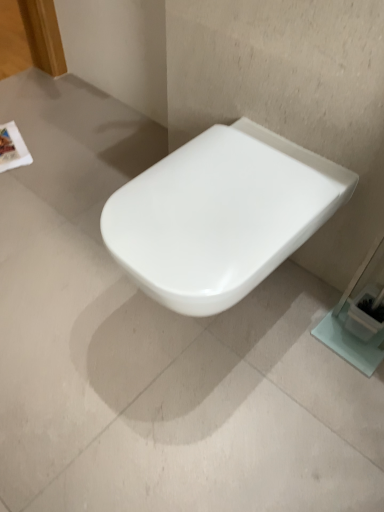
This screenshot has height=512, width=384. In order to click on white glossy toilet at center in this screenshot , I will do `click(220, 215)`.

Image resolution: width=384 pixels, height=512 pixels. Describe the element at coordinates (220, 215) in the screenshot. I see `white glossy toilet at center` at that location.

Locate an element on the screen. The image size is (384, 512). white glossy toilet at center is located at coordinates (220, 215).